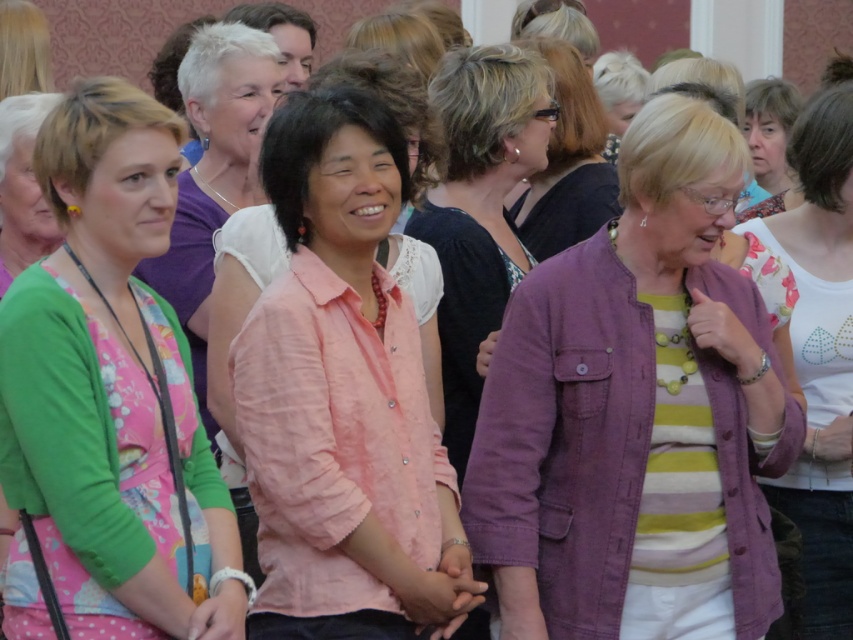
Question: Estimate the real-world distances between objects in this image. Which object is farther from the matte pink blouse at center?

Choices:
 (A) printed fabric blouse at upper right
 (B) green floral dress at left
 (C) purple cotton jacket at center
 (D) pink linen shirt at center

Answer: (A)

Question: Which of the following is the closest to the observer?

Choices:
 (A) striped knit sweater at center
 (B) printed fabric blouse at upper right
 (C) purple cotton jacket at center

Answer: (C)

Question: Does striped knit sweater at center have a greater width compared to pink cotton shirt at center?

Choices:
 (A) yes
 (B) no

Answer: (B)

Question: Which point is closer to the camera?

Choices:
 (A) pink cotton shirt at center
 (B) printed fabric blouse at upper right
 (C) matte pink blouse at center
 (D) striped knit sweater at center

Answer: (C)

Question: Does striped knit sweater at center have a greater width compared to printed fabric blouse at upper right?

Choices:
 (A) no
 (B) yes

Answer: (A)

Question: Considering the relative positions of purple cotton jacket at center and printed fabric blouse at upper right in the image provided, where is purple cotton jacket at center located with respect to printed fabric blouse at upper right?

Choices:
 (A) left
 (B) right

Answer: (A)